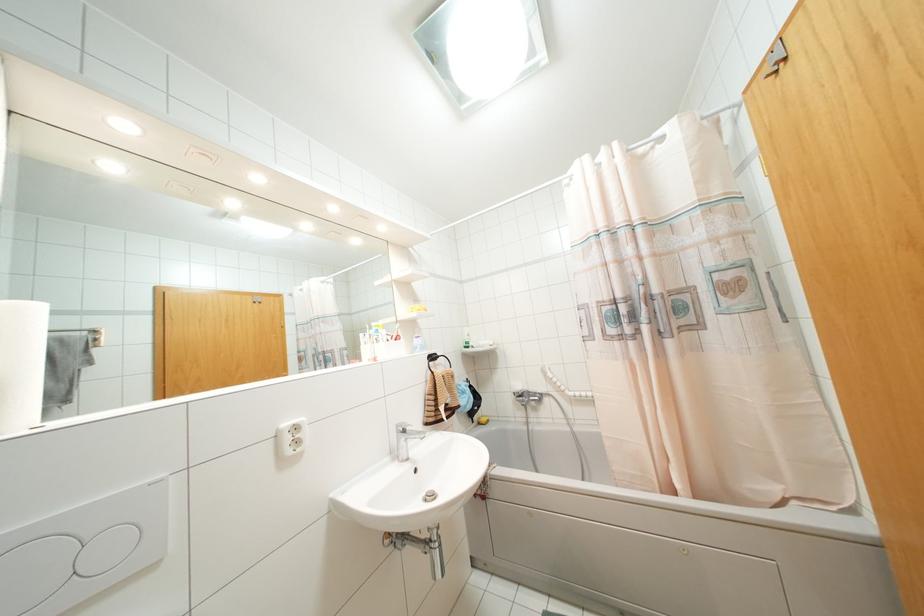
The height and width of the screenshot is (616, 924). In order to click on paper towel roll in this screenshot , I will do `click(21, 363)`.